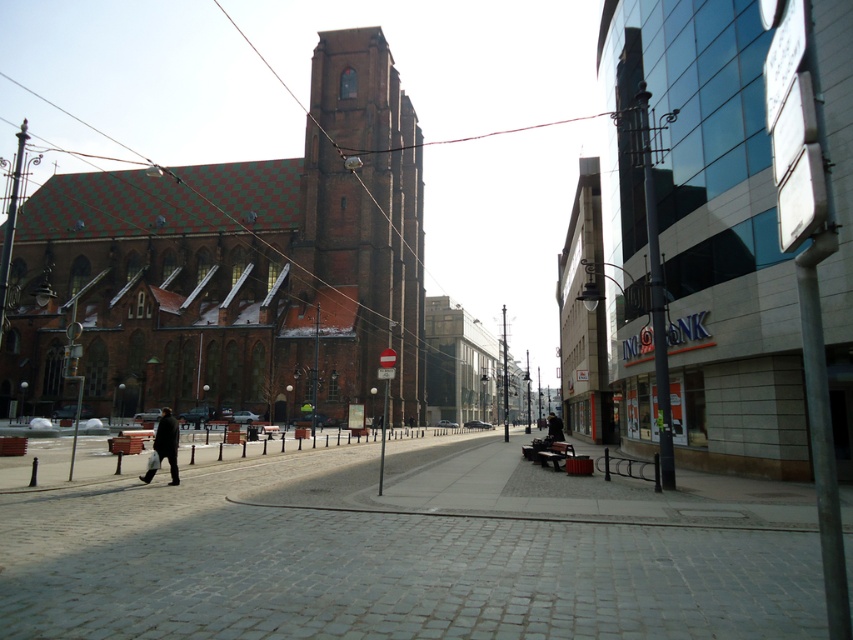
What do you see at coordinates (363, 221) in the screenshot? I see `brown brick tower at center` at bounding box center [363, 221].

Locate an element on the screen. brown brick tower at center is located at coordinates tap(363, 221).

Does brown brick church at left lie behind dark matte coat at lower left?

Yes, brown brick church at left is further from the viewer.

Is point (302, 333) positioned before point (172, 433)?

No, (302, 333) is behind (172, 433).

The width and height of the screenshot is (853, 640). Find the location of `brown brick church at left`. brown brick church at left is located at coordinates (236, 266).

You are a GUI agent. You are given a task and a screenshot of the screen. Output one action in this format:
    pyautogui.click(x=<x>, y=<y>)
    Task: Click on the brown brick church at left
    Image resolution: width=853 pixels, height=640 pixels.
    Given the screenshot: What is the action you would take?
    pyautogui.click(x=236, y=266)

Is gray cobblestone pavement at center above brown brick church at left?

No, gray cobblestone pavement at center is not above brown brick church at left.

This screenshot has height=640, width=853. Identify the location of gray cobblestone pavement at center. (397, 547).